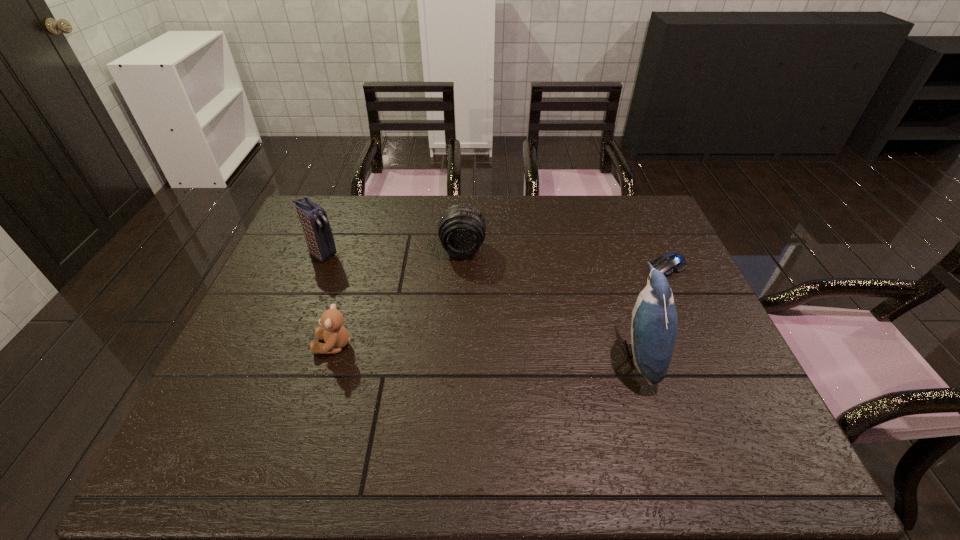
Where is `free space located 0.280m with the zip open on the second tallest object`? Image resolution: width=960 pixels, height=540 pixels. free space located 0.280m with the zip open on the second tallest object is located at coordinates (397, 303).

Find the location of a particular element. This screenshot has height=540, width=960. vacant space located 0.170m at the front element of the third object from left to right is located at coordinates (460, 302).

Find the location of `free space located 0.330m at the front element of the third object from left to right`. free space located 0.330m at the front element of the third object from left to right is located at coordinates (458, 349).

Identify the location of free space located at the front element of the third object from left to right. (459, 324).

Find the location of a particular element. object present at the near edge is located at coordinates (653, 331).

Identify the location of object positioned at the left edge. This screenshot has width=960, height=540. (x=314, y=221).

Identify the location of object present at the right edge. (671, 263).

You are a GUI agent. You are given a task and a screenshot of the screen. Output one action in this format:
    pyautogui.click(x=<x>, y=<y>)
    Task: Click on the vacant area at the far edge
    This screenshot has height=540, width=960.
    Given the screenshot: What is the action you would take?
    pyautogui.click(x=423, y=204)

Find the location of a particular element. This screenshot has width=960, height=540. vacant area at the near edge of the desktop is located at coordinates (372, 390).

At what (x,y) coordinates should I click in order to perform the action: click on vacant space at the left edge. Please return your answer as a coordinate pair (x, y). The width and height of the screenshot is (960, 540). Looking at the image, I should click on (297, 308).